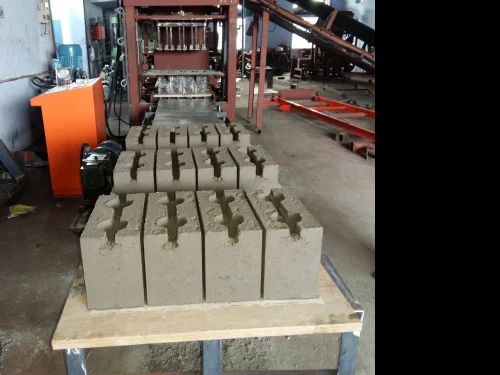
Find the location of `space to right of table`. space to right of table is located at coordinates [347, 245].